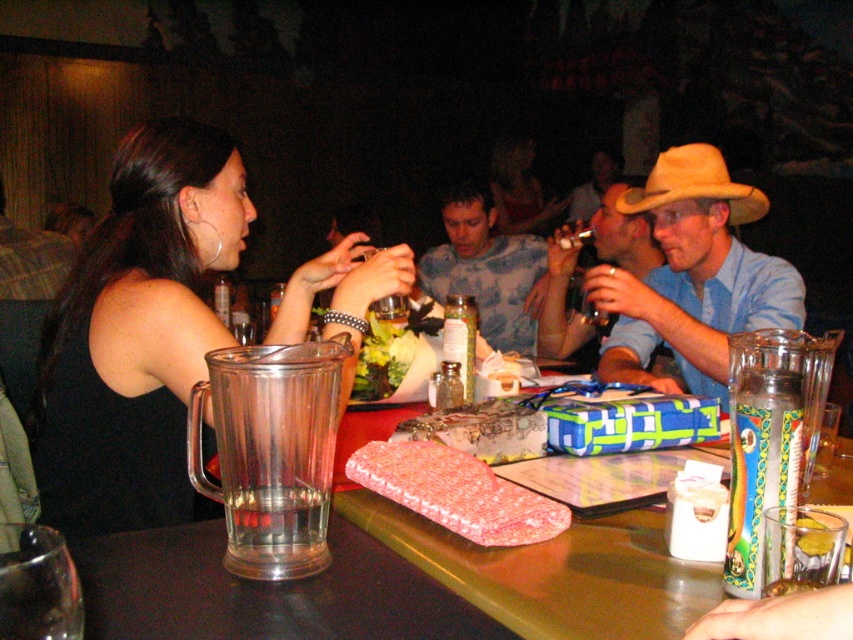
Is point (531, 282) more distant than point (596, 211)?

No, it is not.

Is blue tie-dye shirt at center shorter than matte blue shirt at center?

Yes.

This screenshot has width=853, height=640. I want to click on blue tie-dye shirt at center, so click(486, 268).

Who is taller, matte black dress at center or green leafy salad at center?

matte black dress at center

Between point (498, 161) and point (389, 380), which one is positioned in front?

Positioned in front is point (389, 380).

Where is `matte black dress at center`? Image resolution: width=853 pixels, height=640 pixels. matte black dress at center is located at coordinates (519, 188).

From the picture: Can you confirm if black fabric dress at left is taller than tan suede cowboy hat at right?

Indeed, black fabric dress at left has a greater height compared to tan suede cowboy hat at right.

Which is more to the left, black fabric dress at left or tan suede cowboy hat at right?

black fabric dress at left is more to the left.

Identify the location of black fabric dress at left. This screenshot has width=853, height=640. (137, 332).